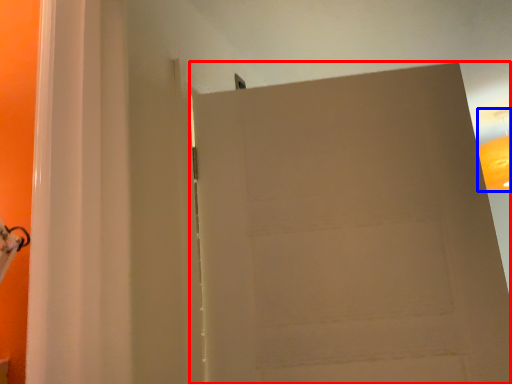
Question: Which object is closer to the camera taking this photo, door (highlighted by a red box) or lamp (highlighted by a blue box)?

Choices:
 (A) door
 (B) lamp

Answer: (A)